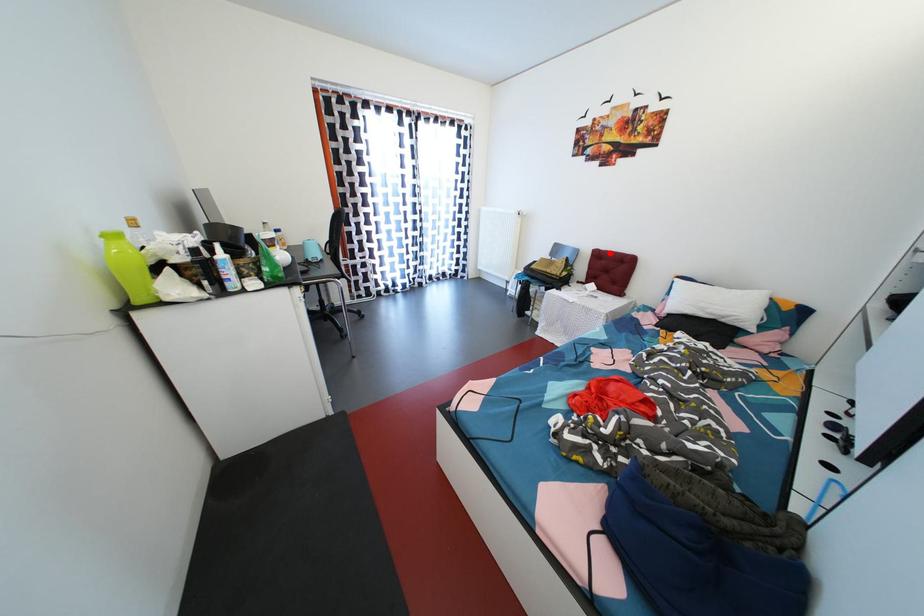
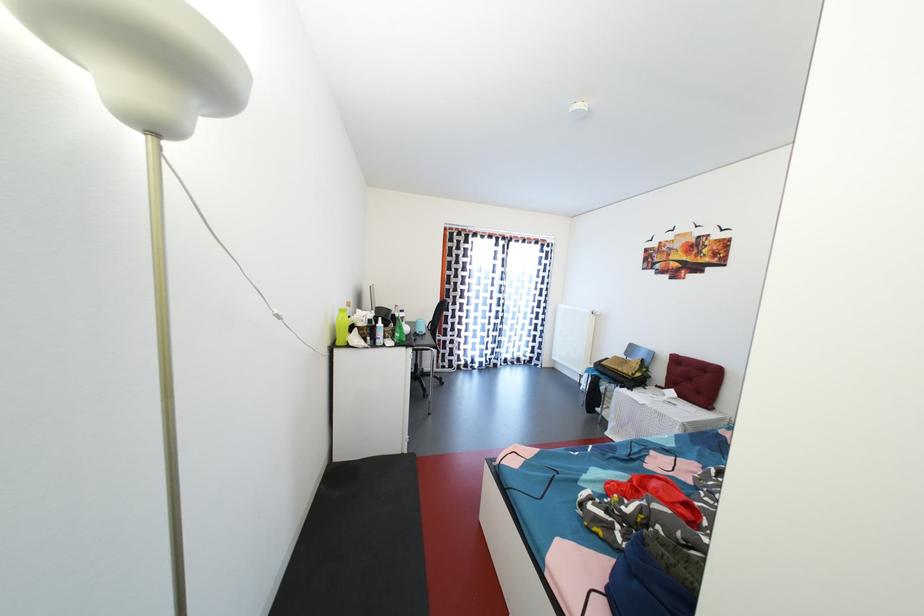
In the second image, find the point that corresponds to the highlighted location in the first image.

(688, 359)